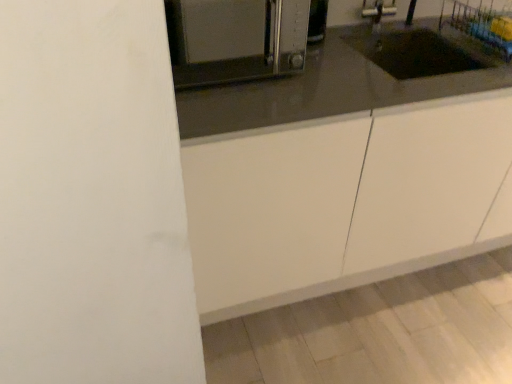
Find the location of a particular element. The height and width of the screenshot is (384, 512). white matte cabinet at center is located at coordinates (345, 200).

This screenshot has height=384, width=512. What do you see at coordinates (345, 200) in the screenshot? I see `white matte cabinet at center` at bounding box center [345, 200].

This screenshot has height=384, width=512. What do you see at coordinates (234, 40) in the screenshot?
I see `satin silver toaster at upper center` at bounding box center [234, 40].

The width and height of the screenshot is (512, 384). I want to click on satin silver toaster at upper center, so click(x=234, y=40).

Find the location of `white matte cabinet at center`. white matte cabinet at center is located at coordinates (345, 200).

Between white matte cabinet at center and satin silver toaster at upper center, which one appears on the right side from the viewer's perspective?

Positioned to the right is white matte cabinet at center.

From the picture: In the image, is white matte cabinet at center positioned in front of or behind satin silver toaster at upper center?

In the image, white matte cabinet at center appears behind satin silver toaster at upper center.

Which is behind, point (226, 218) or point (204, 13)?

The point (204, 13) is farther from the camera.

From the image's perspective, is white matte cabinet at center beneath satin silver toaster at upper center?

Yes, from the image's perspective, white matte cabinet at center is beneath satin silver toaster at upper center.

From a real-world perspective, which object rests below the other?

white matte cabinet at center, from a real-world perspective.

Between white matte cabinet at center and satin silver toaster at upper center, which one has larger width?

With larger width is white matte cabinet at center.

From the picture: Considering the sizes of white matte cabinet at center and satin silver toaster at upper center in the image, is white matte cabinet at center taller or shorter than satin silver toaster at upper center?

white matte cabinet at center is taller than satin silver toaster at upper center.

Can you confirm if white matte cabinet at center is bigger than satin silver toaster at upper center?

Indeed, white matte cabinet at center has a larger size compared to satin silver toaster at upper center.

Is satin silver toaster at upper center completely or partially inside white matte cabinet at center?

No, satin silver toaster at upper center is located outside of white matte cabinet at center.

Is white matte cabinet at center next to satin silver toaster at upper center?

There is a gap between white matte cabinet at center and satin silver toaster at upper center.

Is white matte cabinet at center facing away from satin silver toaster at upper center?

white matte cabinet at center is not turned away from satin silver toaster at upper center.

At what (x,y) coordinates should I click in order to perform the action: click on home appliance on the left of white matte cabinet at center. Please return your answer as a coordinate pair (x, y). This screenshot has width=512, height=384. Looking at the image, I should click on (234, 40).

Does satin silver toaster at upper center appear on the left side of white matte cabinet at center?

Yes, satin silver toaster at upper center is to the left of white matte cabinet at center.

Which object is further away from the camera, satin silver toaster at upper center or white matte cabinet at center?

white matte cabinet at center is behind.

Which is closer to the camera, (281,62) or (298,216)?

Positioned in front is point (281,62).

From the image's perspective, which is below, satin silver toaster at upper center or white matte cabinet at center?

white matte cabinet at center appears lower in the image.

From a real-world perspective, is satin silver toaster at upper center on top of white matte cabinet at center?

Indeed, from a real-world perspective, satin silver toaster at upper center stands above white matte cabinet at center.

Which object is thinner, satin silver toaster at upper center or white matte cabinet at center?

Thinner between the two is satin silver toaster at upper center.

Can you confirm if satin silver toaster at upper center is shorter than white matte cabinet at center?

Yes.

Looking at this image, which of these two, satin silver toaster at upper center or white matte cabinet at center, is bigger?

With larger size is white matte cabinet at center.

Choose the correct answer: Is satin silver toaster at upper center inside white matte cabinet at center or outside it?

satin silver toaster at upper center is outside white matte cabinet at center.

Is satin silver toaster at upper center placed right next to white matte cabinet at center?

They are not placed beside each other.

Is satin silver toaster at upper center facing towards white matte cabinet at center?

No, satin silver toaster at upper center is not aimed at white matte cabinet at center.

Where is `home appliance on the left side of white matte cabinet at center`? The width and height of the screenshot is (512, 384). home appliance on the left side of white matte cabinet at center is located at coordinates (234, 40).

You are a GUI agent. You are given a task and a screenshot of the screen. Output one action in this format:
    pyautogui.click(x=<x>, y=<y>)
    Task: Click on the cabinetry located on the right of satin silver toaster at upper center
    
    Given the screenshot: What is the action you would take?
    pyautogui.click(x=345, y=200)

The height and width of the screenshot is (384, 512). There is a white matte cabinet at center. Find the location of `home appliance above it (from a real-world perspective)`. home appliance above it (from a real-world perspective) is located at coordinates (234, 40).